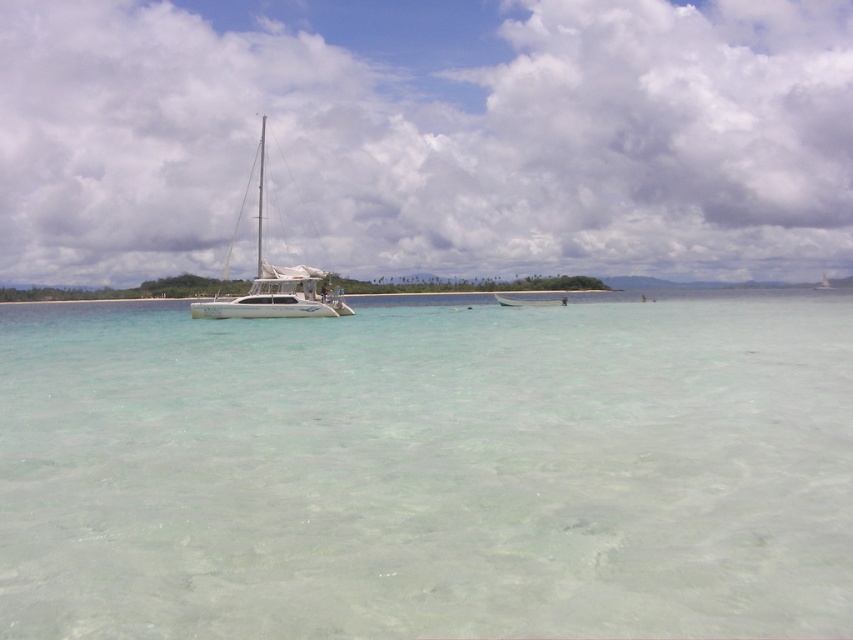
Does white glossy sailboat at center have a lesser width compared to green plastic boat at center?

Incorrect, white glossy sailboat at center's width is not less than green plastic boat at center's.

Is point (289, 292) in front of point (549, 305)?

Yes, it is in front of point (549, 305).

Is point (257, 285) positioned behind point (498, 298)?

No.

Find the location of a particular element. The width and height of the screenshot is (853, 640). white glossy sailboat at center is located at coordinates (276, 282).

Which of these two, clear water at center or green plastic boat at center, stands taller?

clear water at center

Does clear water at center have a lesser width compared to green plastic boat at center?

No.

Between point (138, 326) and point (496, 300), which one is positioned behind?

The point (496, 300) is more distant.

You are a GUI agent. You are given a task and a screenshot of the screen. Output one action in this format:
    pyautogui.click(x=<x>, y=<y>)
    Task: Click on the clear water at center
    The image size is (853, 640).
    Given the screenshot: What is the action you would take?
    pyautogui.click(x=428, y=472)

Is clear water at center to the right of white glossy sailboat at center from the viewer's perspective?

Indeed, clear water at center is positioned on the right side of white glossy sailboat at center.

At what (x,y) coordinates should I click in order to perform the action: click on clear water at center. Please return your answer as a coordinate pair (x, y). The height and width of the screenshot is (640, 853). Looking at the image, I should click on (428, 472).